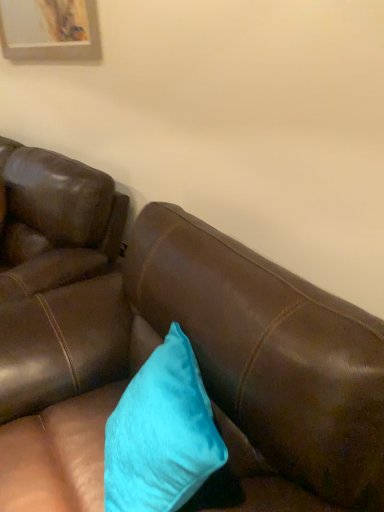
Image resolution: width=384 pixels, height=512 pixels. Describe the element at coordinates (201, 371) in the screenshot. I see `brown leather couch at center` at that location.

Find the location of a particular element. The width and height of the screenshot is (384, 512). brown leather couch at center is located at coordinates (201, 371).

In the scene shown: Measure the distance between point (21,459) and camera.

Point (21,459) is 3.69 feet away from camera.

Describe the element at coordinates (161, 434) in the screenshot. I see `turquoise velvet pillow at center` at that location.

This screenshot has width=384, height=512. Identify the location of turquoise velvet pillow at center. (161, 434).

Identify the location of brown leather couch at center. Image resolution: width=384 pixels, height=512 pixels. (201, 371).

Considering the relative positions of turquoise velvet pillow at center and brown leather couch at center in the image provided, is turquoise velvet pillow at center to the right of brown leather couch at center from the viewer's perspective?

Indeed, turquoise velvet pillow at center is positioned on the right side of brown leather couch at center.

Is turquoise velvet pillow at center positioned before brown leather couch at center?

No, turquoise velvet pillow at center is further to the viewer.

Is point (156, 443) less distant than point (46, 493)?

Yes, point (156, 443) is closer to viewer.

From the image's perspective, does turquoise velvet pillow at center appear higher than brown leather couch at center?

Yes, from the image's perspective, turquoise velvet pillow at center is on top of brown leather couch at center.

From a real-world perspective, between turquoise velvet pillow at center and brown leather couch at center, who is vertically lower?

From a 3D spatial view, brown leather couch at center is below.

Does turquoise velvet pillow at center have a lesser width compared to brown leather couch at center?

Yes.

Is turquoise velvet pillow at center taller than brown leather couch at center?

Incorrect, the height of turquoise velvet pillow at center is not larger of that of brown leather couch at center.

Can you confirm if turquoise velvet pillow at center is bigger than brown leather couch at center?

No, turquoise velvet pillow at center is not bigger than brown leather couch at center.

Is turquoise velvet pillow at center located outside brown leather couch at center?

No, turquoise velvet pillow at center is not entirely external to brown leather couch at center.

Is turquoise velvet pillow at center directly adjacent to brown leather couch at center?

There is a gap between turquoise velvet pillow at center and brown leather couch at center.

Is turquoise velvet pillow at center oriented towards brown leather couch at center?

Yes, turquoise velvet pillow at center is oriented towards brown leather couch at center.

How different are the orientations of turquoise velvet pillow at center and brown leather couch at center in degrees?

19.5 degrees.

Find the location of a particular element. pillow behind the brown leather couch at center is located at coordinates (161, 434).

Consider the image. Which is more to the left, brown leather couch at center or turquoise velvet pillow at center?

From the viewer's perspective, brown leather couch at center appears more on the left side.

Considering the relative positions of brown leather couch at center and turquoise velvet pillow at center in the image provided, is brown leather couch at center behind turquoise velvet pillow at center?

No, the depth of brown leather couch at center is less than that of turquoise velvet pillow at center.

Considering the positions of point (127, 331) and point (161, 447), is point (127, 331) closer or farther from the camera than point (161, 447)?

Point (127, 331).

From the image's perspective, between brown leather couch at center and turquoise velvet pillow at center, which one is located above?

From the image's view, turquoise velvet pillow at center is above.

From a real-world perspective, which is physically below, brown leather couch at center or turquoise velvet pillow at center?

From a 3D spatial view, brown leather couch at center is below.

Which object is thinner, brown leather couch at center or turquoise velvet pillow at center?

With smaller width is turquoise velvet pillow at center.

Looking at this image, is brown leather couch at center taller or shorter than turquoise velvet pillow at center?

Clearly, brown leather couch at center is taller compared to turquoise velvet pillow at center.

Which of these two, brown leather couch at center or turquoise velvet pillow at center, is bigger?

Bigger between the two is brown leather couch at center.

Is brown leather couch at center located outside turquoise velvet pillow at center?

brown leather couch at center lies outside turquoise velvet pillow at center's area.

Are brown leather couch at center and turquoise velvet pillow at center beside each other?

No.

Is brown leather couch at center facing towards turquoise velvet pillow at center?

Yes, brown leather couch at center faces towards turquoise velvet pillow at center.

This screenshot has width=384, height=512. In order to click on pillow behind the brown leather couch at center in this screenshot , I will do `click(161, 434)`.

I want to click on studio couch that is on the left side of turquoise velvet pillow at center, so click(201, 371).

Locate an element on the screen. This screenshot has height=512, width=384. pillow above the brown leather couch at center (from the image's perspective) is located at coordinates (161, 434).